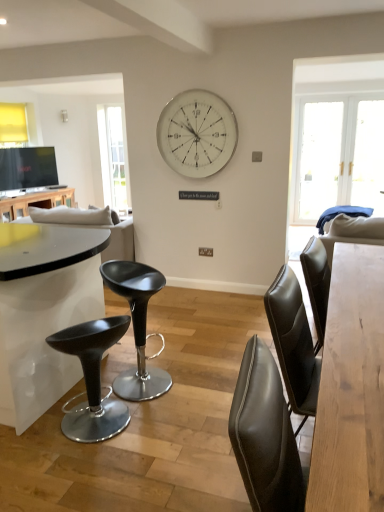
Question: Is matte black stool at center in front of or behind clear glass window at left in the image?

Choices:
 (A) behind
 (B) front

Answer: (B)

Question: Considering the positions of matte black stool at center and clear glass window at left in the image, is matte black stool at center wider or thinner than clear glass window at left?

Choices:
 (A) thin
 (B) wide

Answer: (B)

Question: Which of these objects is positioned farthest from the white glossy table at left, which is counted as the first table, starting from the left?

Choices:
 (A) matte black stool at center
 (B) matte black stool at lower left
 (C) clear glass window at left
 (D) light brown wooden table at center, which is the first table from right to left
 (E) white metallic wall clock at upper center

Answer: (D)

Question: Which is farther from the light brown wooden table at center, which is the 2th table from top to bottom?

Choices:
 (A) white glossy table at left, which is counted as the first table, starting from the left
 (B) clear glass window at left
 (C) matte black stool at center
 (D) matte black stool at lower left
 (E) white metallic wall clock at upper center

Answer: (B)